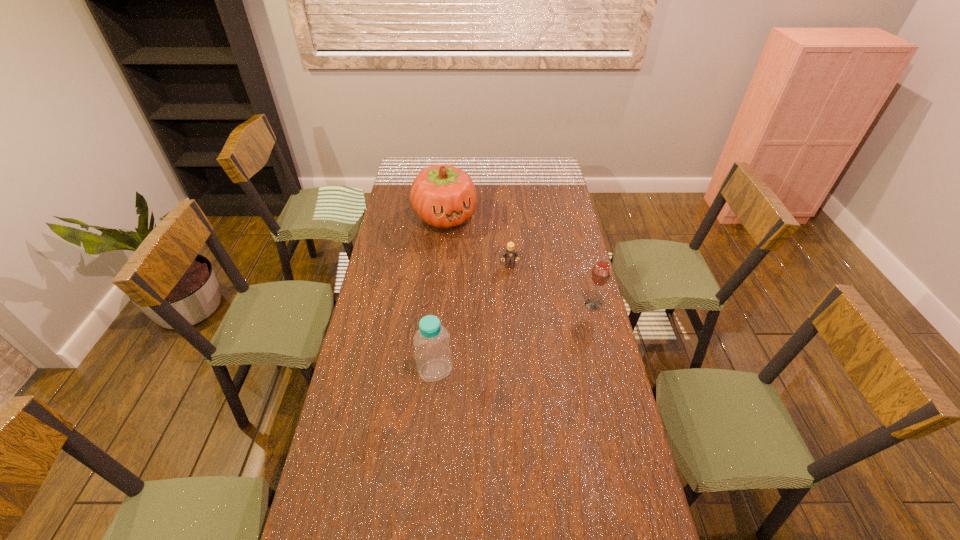
Find the location of a particular element. This screenshot has width=960, height=540. vacant space at the far right corner is located at coordinates (560, 173).

You are a GUI agent. You are given a task and a screenshot of the screen. Output one action in this format:
    pyautogui.click(x=<x>, y=<y>)
    Task: Click on the free spot between the Lego and the pumpkin
    This screenshot has height=540, width=960.
    Given the screenshot: What is the action you would take?
    pyautogui.click(x=477, y=241)

You are a GUI agent. You are given a task and a screenshot of the screen. Output one action in this format:
    pyautogui.click(x=<x>, y=<y>)
    Task: Click on the free area in between the farthest object and the shortest object
    
    Given the screenshot: What is the action you would take?
    pyautogui.click(x=477, y=241)

Where is `free space between the second object from right to left and the nearest object`? free space between the second object from right to left and the nearest object is located at coordinates (472, 318).

Where is `blank region between the bottle and the shortest object`? This screenshot has width=960, height=540. blank region between the bottle and the shortest object is located at coordinates (472, 318).

Locate an element on the screen. The image size is (960, 540). vacant area that lies between the third nearest object and the pumpkin is located at coordinates (477, 241).

Find the location of a particular element. Image resolution: width=960 pixels, height=540 pixels. free space between the nearest object and the pumpkin is located at coordinates (440, 293).

Find the location of a particular element. The width and height of the screenshot is (960, 540). blank region between the rightmost object and the nearest object is located at coordinates (515, 338).

You are a GUI agent. You are given a task and a screenshot of the screen. Output one action in this format:
    pyautogui.click(x=<x>, y=<y>)
    Task: Click on the empty space between the farthest object and the third tallest object
    Image resolution: width=960 pixels, height=540 pixels.
    Given the screenshot: What is the action you would take?
    pyautogui.click(x=519, y=260)

The height and width of the screenshot is (540, 960). What are the coordinates of `vacant region between the farthest object and the nearest object` in the screenshot? It's located at (440, 293).